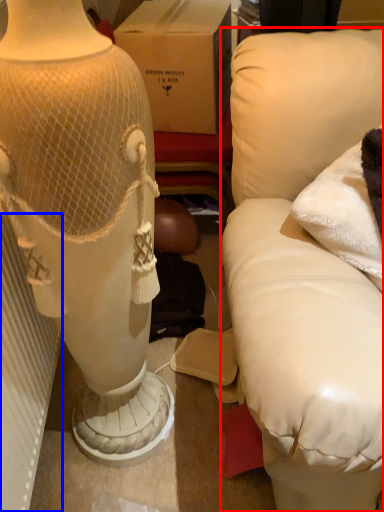
Question: Among these objects, which one is nearest to the camera, furniture (highlighted by a red box) or radiator (highlighted by a blue box)?

Choices:
 (A) furniture
 (B) radiator

Answer: (A)